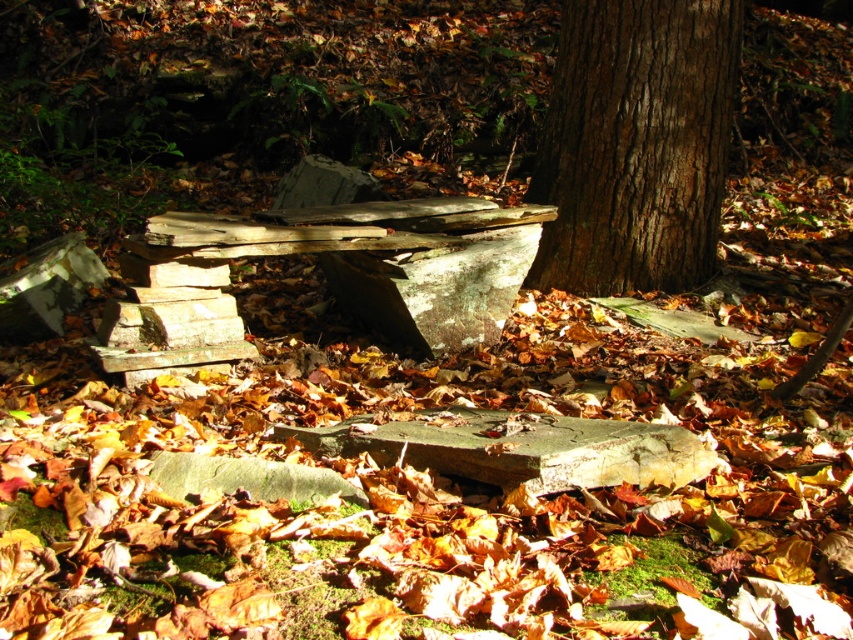
Question: Among these points, which one is farthest from the camera?

Choices:
 (A) (515, 481)
 (B) (329, 470)

Answer: (B)

Question: Which point is closer to the camera?

Choices:
 (A) (271, 460)
 (B) (374, 440)

Answer: (B)

Question: Observing the image, what is the correct spatial positioning of green weathered stone at center in reference to gray rough stone at center?

Choices:
 (A) above
 (B) below

Answer: (A)

Question: Can you confirm if brown rough bark tree at center is positioned below green weathered stone at center?

Choices:
 (A) yes
 (B) no

Answer: (B)

Question: Is brown rough bark tree at center wider than green weathered stone at center?

Choices:
 (A) no
 (B) yes

Answer: (A)

Question: Which of the following is the closest to the observer?

Choices:
 (A) brown rough bark tree at center
 (B) gray rough stone at center
 (C) green weathered stone at center

Answer: (B)